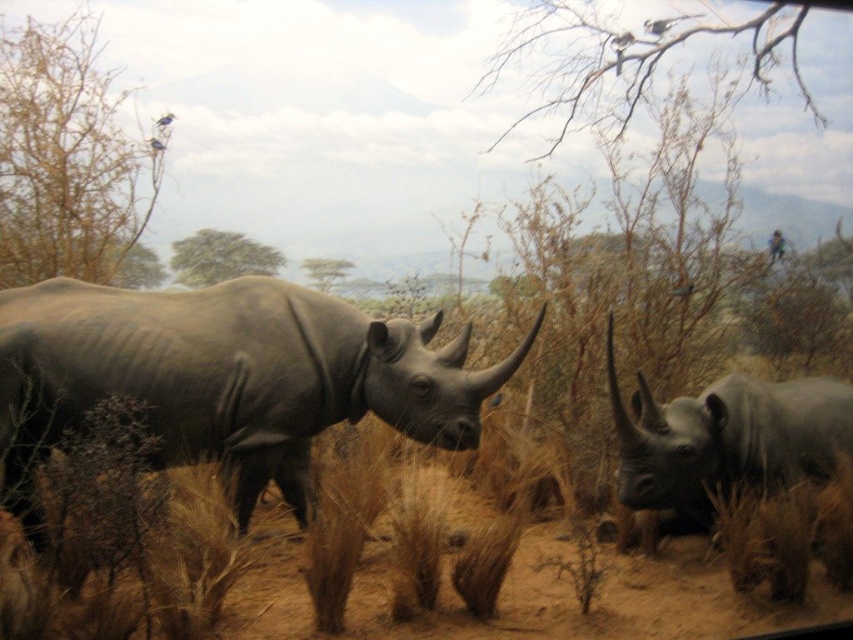
Which is above, matte gray rhinoceros at center or matte gray rhinoceros at right?

matte gray rhinoceros at center is above.

Is matte gray rhinoceros at center to the left of matte gray rhinoceros at right from the viewer's perspective?

Correct, you'll find matte gray rhinoceros at center to the left of matte gray rhinoceros at right.

At what (x,y) coordinates should I click in order to perform the action: click on matte gray rhinoceros at center. Please return your answer as a coordinate pair (x, y). This screenshot has width=853, height=640. Looking at the image, I should click on (228, 376).